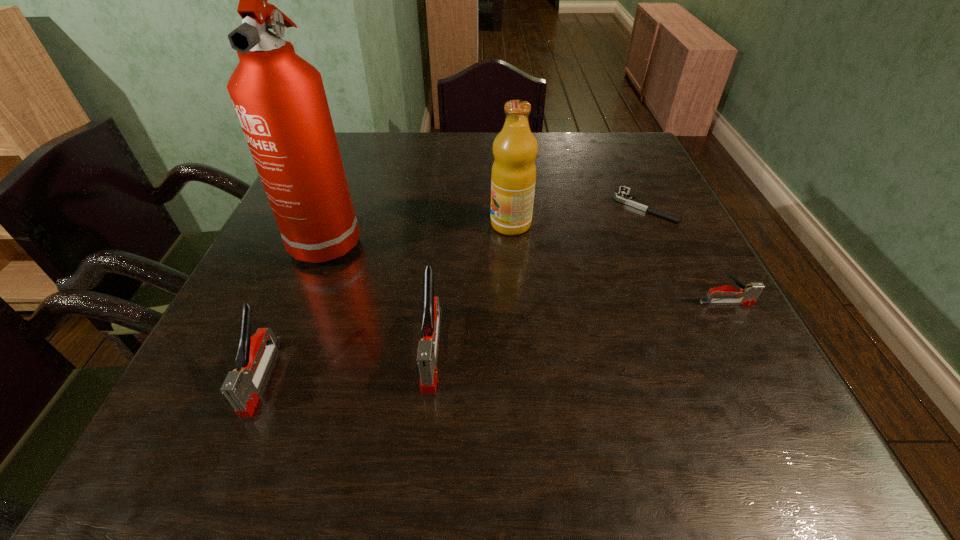
In order to click on the leftmost stapler in this screenshot , I will do `click(242, 386)`.

This screenshot has width=960, height=540. What are the coordinates of `the fourth tallest object` in the screenshot? It's located at (242, 386).

Where is `the third object from left to right`? the third object from left to right is located at coordinates (427, 350).

You are a GUI agent. You are given a task and a screenshot of the screen. Output one action in this format:
    pyautogui.click(x=<x>, y=<y>)
    Task: Click on the rightmost stapler
    
    Given the screenshot: What is the action you would take?
    pyautogui.click(x=748, y=294)

Locate an element on the screen. This screenshot has width=960, height=540. the second shortest object is located at coordinates (748, 294).

Find the location of a particular element. the shortest object is located at coordinates (623, 197).

The height and width of the screenshot is (540, 960). Find the location of `the tallest object`. the tallest object is located at coordinates (279, 98).

In order to click on the third object from right to left in this screenshot , I will do `click(513, 176)`.

Where is `the second tallest object`? the second tallest object is located at coordinates (513, 176).

Image resolution: width=960 pixels, height=540 pixels. I want to click on free space located on the front-facing side of the pistol, so click(x=539, y=206).